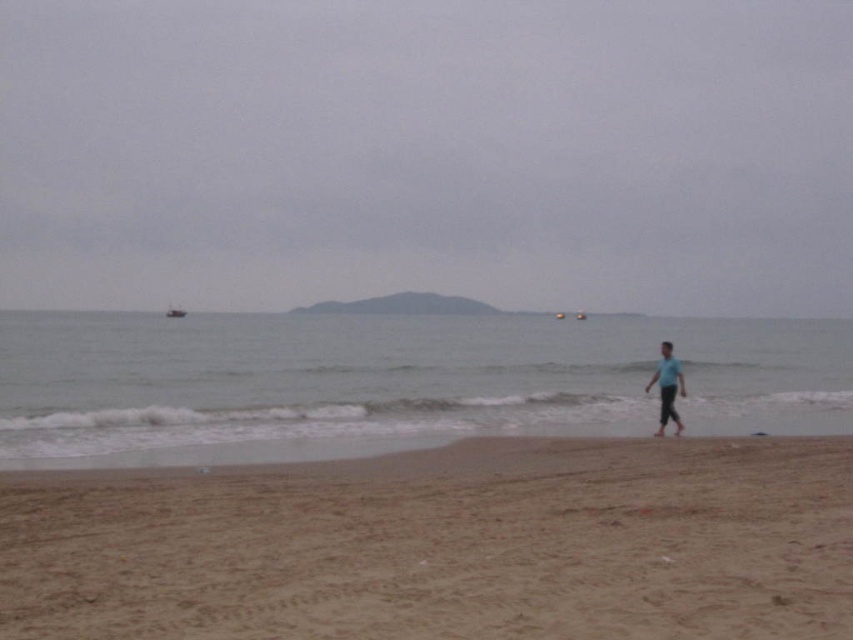
Question: Can you confirm if gray matte water at center is thinner than blue cotton shirt at lower right?

Choices:
 (A) yes
 (B) no

Answer: (B)

Question: Estimate the real-world distances between objects in this image. Which object is closer to the gray matte water at center?

Choices:
 (A) brown sandy beach at lower center
 (B) gray matte sky at upper center
 (C) blue cotton shirt at lower right

Answer: (C)

Question: Does gray matte sky at upper center come in front of gray matte water at center?

Choices:
 (A) no
 (B) yes

Answer: (A)

Question: Which point is closer to the camera?

Choices:
 (A) gray matte water at center
 (B) blue cotton shirt at lower right

Answer: (A)

Question: Does gray matte sky at upper center come behind brown sandy beach at lower center?

Choices:
 (A) yes
 (B) no

Answer: (A)

Question: Among these points, which one is nearest to the camera?

Choices:
 (A) (668, 413)
 (B) (32, 394)
 (C) (567, 584)

Answer: (C)